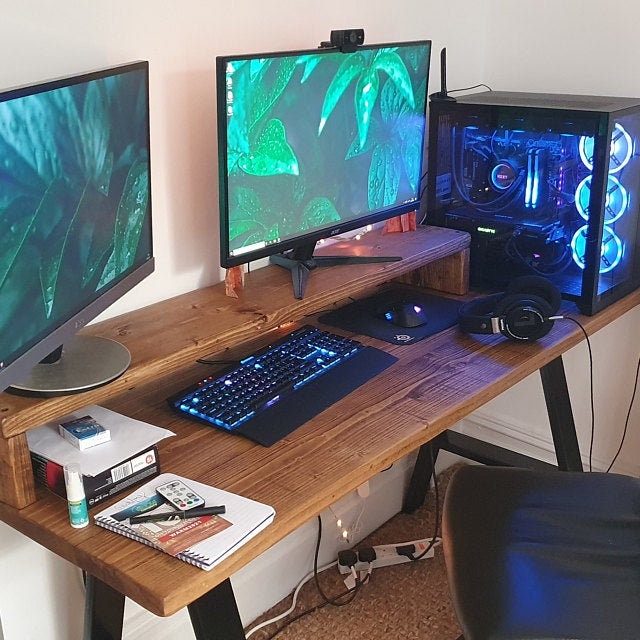
At what (x,y) coordinates should I click in order to perform the action: click on mouse. Please return your answer as a coordinate pair (x, y). The height and width of the screenshot is (640, 640). Looking at the image, I should click on (410, 310).